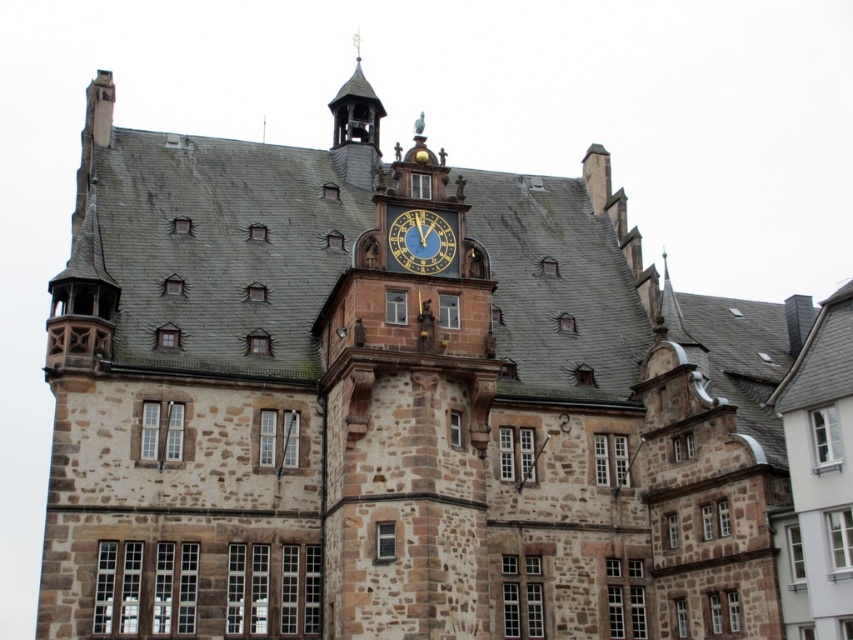
Question: Among these points, which one is nearest to the camera?

Choices:
 (A) (403, 241)
 (B) (355, 122)

Answer: (A)

Question: From the image, what is the correct spatial relationship of polished brass bell tower at upper center in relation to blue painted metal clock at center?

Choices:
 (A) left
 (B) right

Answer: (A)

Question: Can you confirm if polished brass bell tower at upper center is thinner than blue painted metal clock at center?

Choices:
 (A) yes
 (B) no

Answer: (B)

Question: Does polished brass bell tower at upper center appear on the left side of blue painted metal clock at center?

Choices:
 (A) no
 (B) yes

Answer: (B)